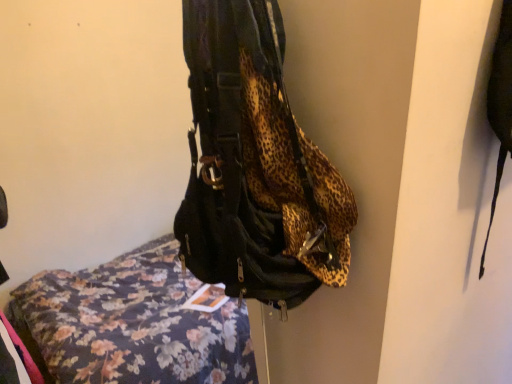
Where is `leopard print fabric handbag at center`? This screenshot has width=512, height=384. leopard print fabric handbag at center is located at coordinates (255, 166).

What do you see at coordinates (255, 166) in the screenshot?
I see `leopard print fabric handbag at center` at bounding box center [255, 166].

Image resolution: width=512 pixels, height=384 pixels. I want to click on leopard print fabric handbag at center, so point(255,166).